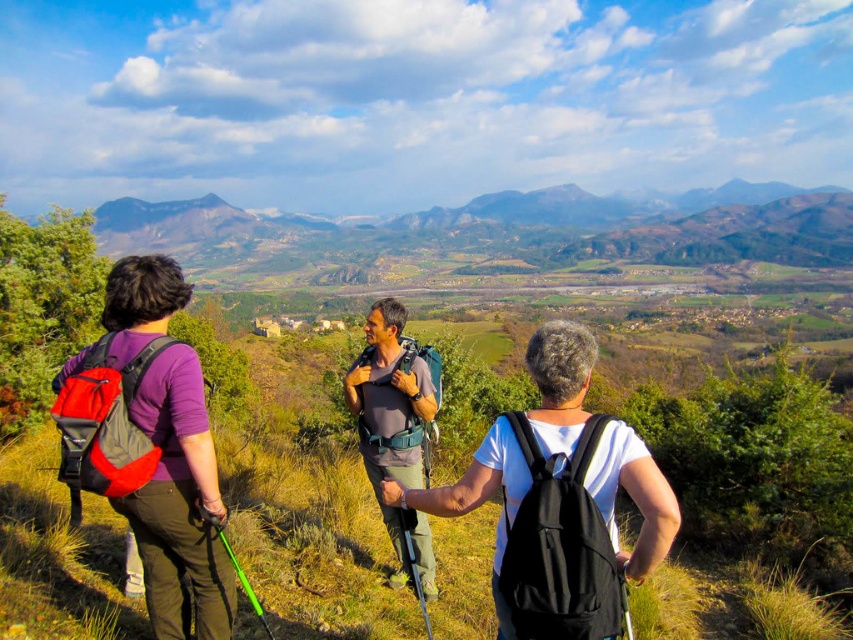
Question: Which point appears farthest from the camera in this image?

Choices:
 (A) (140, 480)
 (B) (405, 388)

Answer: (B)

Question: Does matte black backpack at center have a greater width compared to matte gray shirt at center?

Choices:
 (A) no
 (B) yes

Answer: (B)

Question: Is matte black backpack at center to the left of matte gray shirt at center from the viewer's perspective?

Choices:
 (A) no
 (B) yes

Answer: (A)

Question: Among these objects, which one is farthest from the camera?

Choices:
 (A) matte gray shirt at center
 (B) matte black backpack at center

Answer: (A)

Question: Is matte black backpack at center positioned at the back of matte gray shirt at center?

Choices:
 (A) yes
 (B) no

Answer: (B)